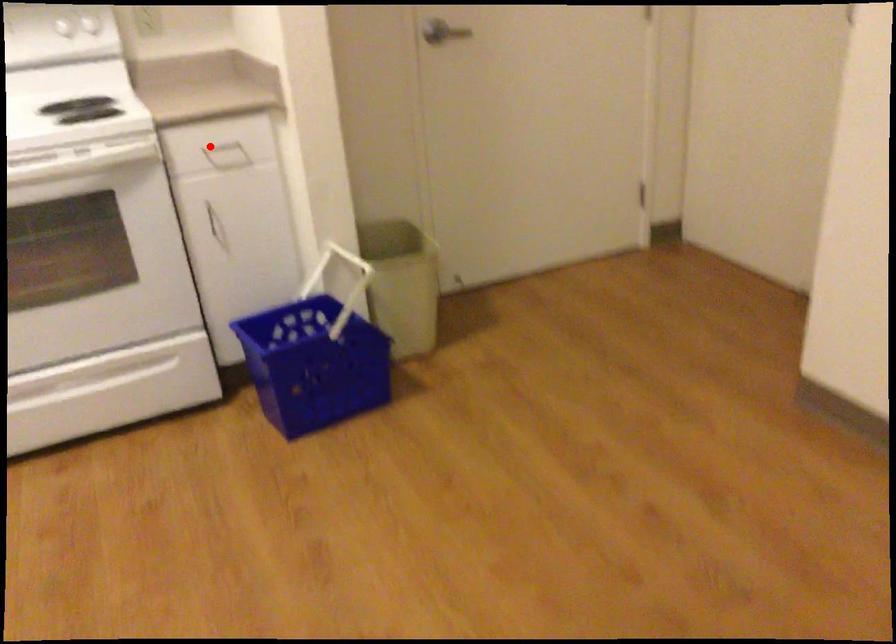
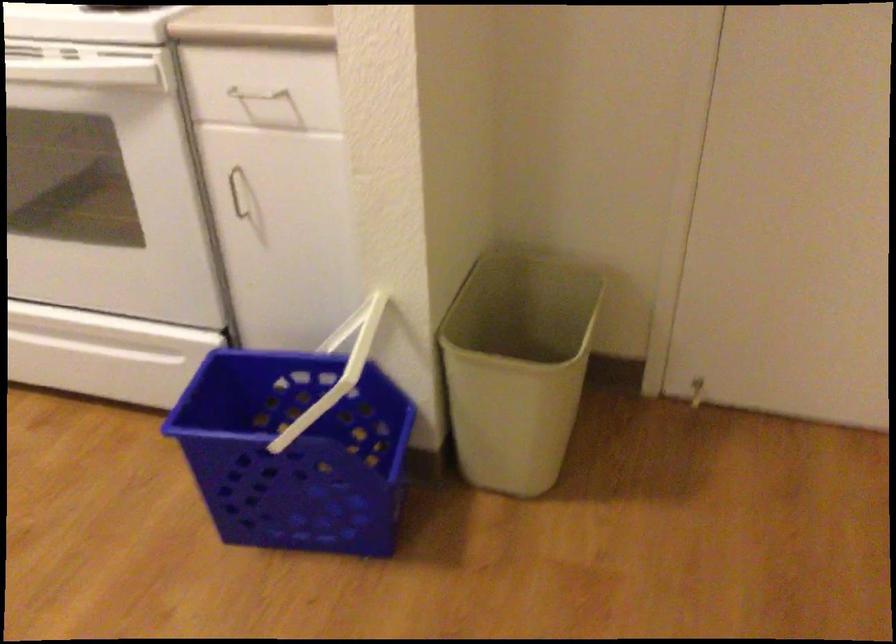
Where in the second image is the point corresponding to the highlighted location from the first image?

(253, 98)